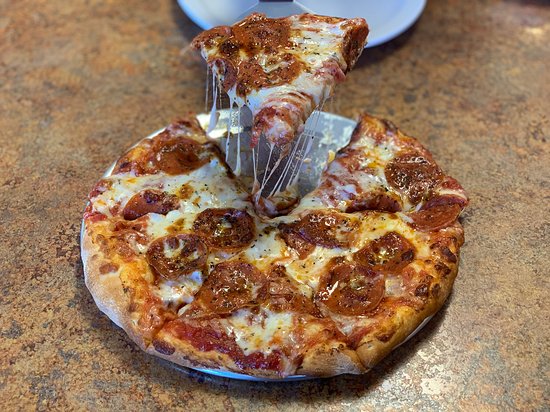
At what (x,y) coordinates should I click in order to perform the action: click on table to the right of pizza. Please return your answer as a coordinate pair (x, y). This screenshot has height=412, width=550. Looking at the image, I should click on (498, 222).